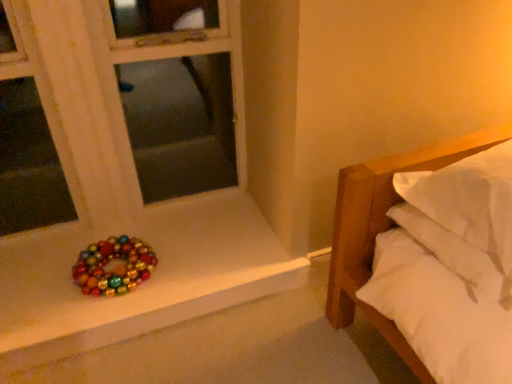
Question: Relative to white soft bed at right, is glossy multicolored beads at lower left in front or behind?

Choices:
 (A) behind
 (B) front

Answer: (A)

Question: Is glossy multicolored beads at lower left taller or shorter than white soft bed at right?

Choices:
 (A) tall
 (B) short

Answer: (B)

Question: Estimate the real-world distances between objects in this image. Which object is closer to the white soft bed at right?

Choices:
 (A) multicolored baubles at lower left
 (B) glossy multicolored beads at lower left

Answer: (A)

Question: Estimate the real-world distances between objects in this image. Which object is closer to the multicolored baubles at lower left?

Choices:
 (A) white soft bed at right
 (B) glossy multicolored beads at lower left

Answer: (B)